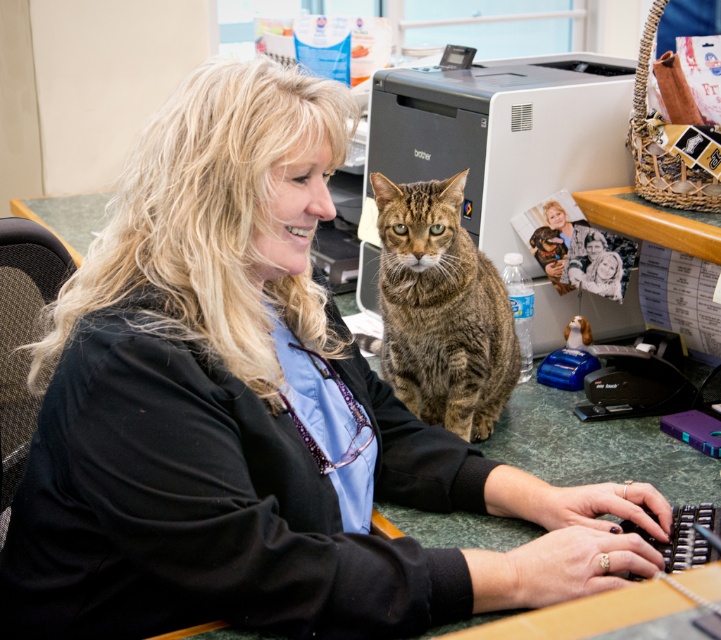
You are organizing the desk items and want to place the matte black printer at center and the tabby fur cat at center side by side without overlapping. Which item should be placed to the left to fit better?

The tabby fur cat at center should be placed to the left since the matte black printer at center is wider and would require more space on the right side to accommodate its width.

Based on the photo, you are standing in front of the desk and want to place a new item on the desk. The desk has two specific points marked at coordinates point (619, 125) and point (503, 332). According to the image, which point is closer to you?

Point (503, 332) is closer to you because it is in front of point (619, 125).